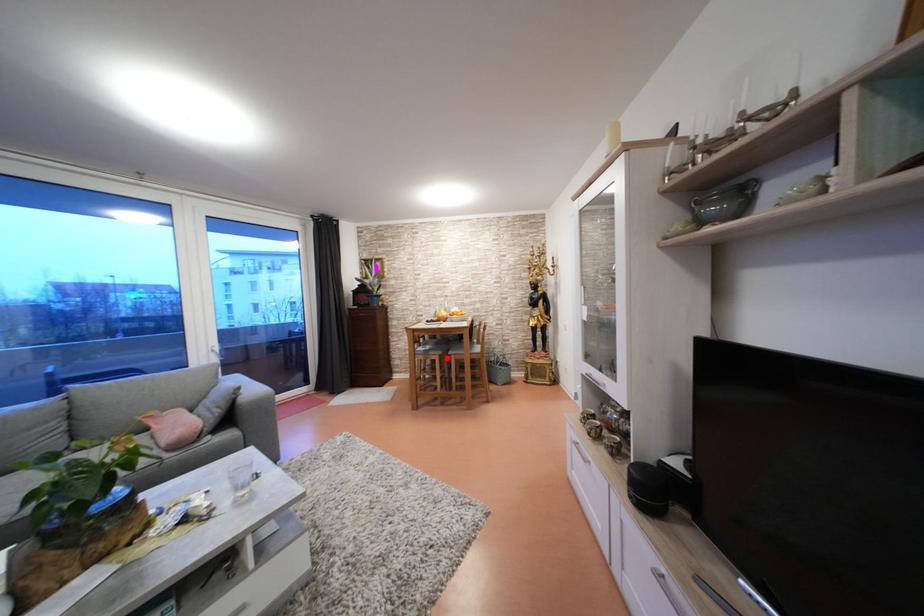
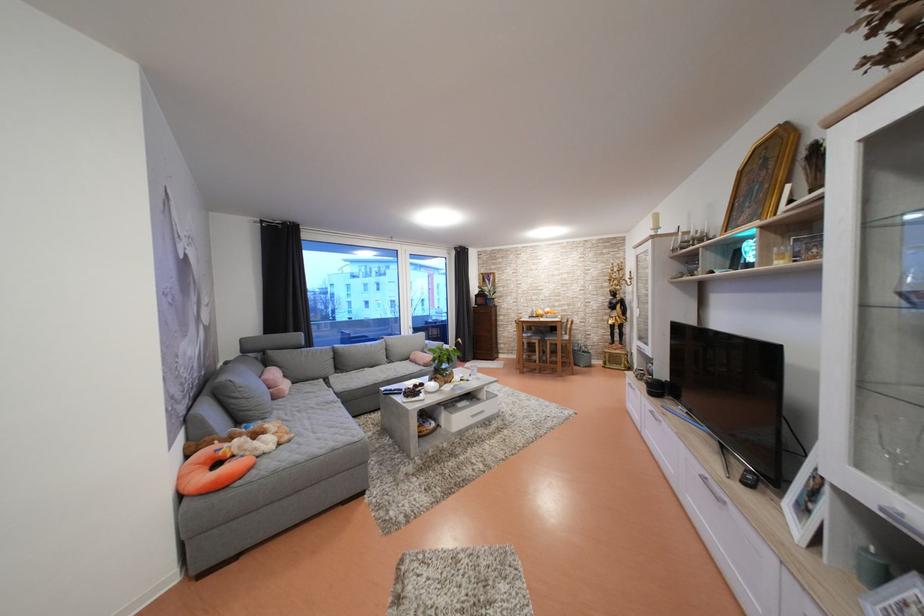
In the second image, find the point that corresponds to the highlighted location in the first image.

(545, 342)